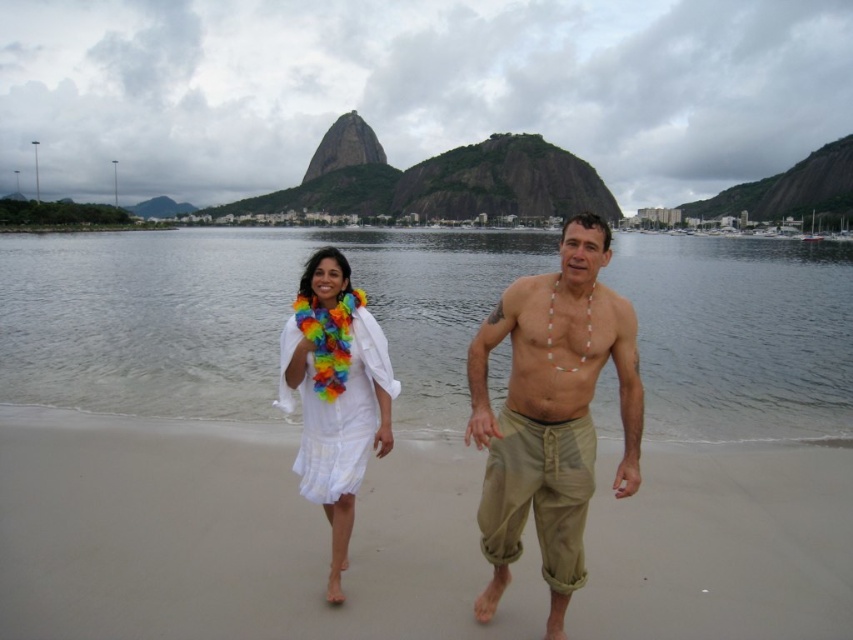
Question: Is clear water at center bigger than white fabric dress at center?

Choices:
 (A) yes
 (B) no

Answer: (A)

Question: Which point is farther to the camera?

Choices:
 (A) beige cotton pants at center
 (B) white cotton dress at center

Answer: (A)

Question: Can you confirm if light beige sand at center is positioned above white cotton dress at center?

Choices:
 (A) yes
 (B) no

Answer: (B)

Question: Based on their relative distances, which object is farther from the white cotton dress at center?

Choices:
 (A) light beige sand at center
 (B) white fabric dress at center

Answer: (A)

Question: Can you confirm if white fabric dress at center is thinner than beige fabric shorts at center?

Choices:
 (A) yes
 (B) no

Answer: (B)

Question: Which object is the farthest from the white fabric dress at center?

Choices:
 (A) white cotton dress at center
 (B) beige fabric shorts at center
 (C) clear water at center

Answer: (C)